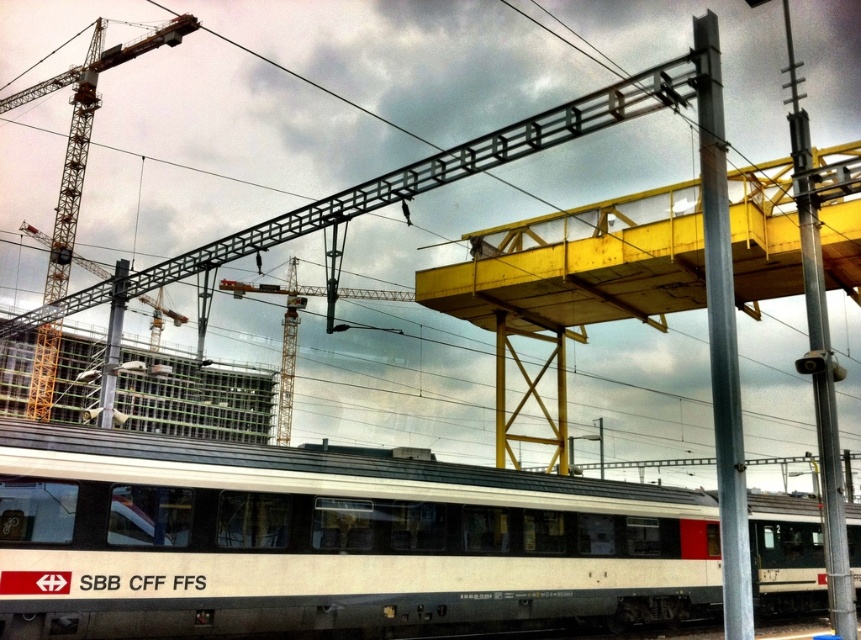
Between metallic gray pole at right and metallic yellow crane at upper left, which one has more height?

metallic gray pole at right is taller.

Does metallic gray pole at right appear over metallic yellow crane at upper left?

Correct, metallic gray pole at right is located above metallic yellow crane at upper left.

Where is `metallic gray pole at right`? Image resolution: width=861 pixels, height=640 pixels. metallic gray pole at right is located at coordinates (827, 426).

The image size is (861, 640). I want to click on metallic gray pole at right, so click(827, 426).

Identify the location of metallic gray pole at center. The height and width of the screenshot is (640, 861). (722, 333).

From the picture: Does metallic gray pole at center have a lesser width compared to metallic yellow crane at upper left?

Yes.

Which is in front, point (731, 572) or point (194, 19)?

Point (731, 572) is more forward.

Identify the location of metallic gray pole at center. (722, 333).

Is white matte passenger train at center smaller than metallic yellow crane at upper left?

Correct, white matte passenger train at center occupies less space than metallic yellow crane at upper left.

The width and height of the screenshot is (861, 640). I want to click on white matte passenger train at center, so click(x=325, y=540).